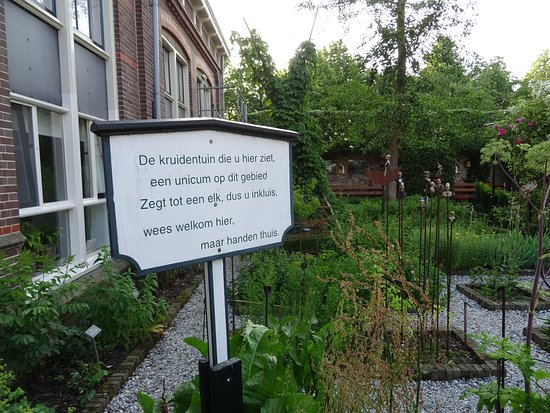
This screenshot has height=413, width=550. What are the coordinates of `window` in the screenshot? It's located at (34, 46).